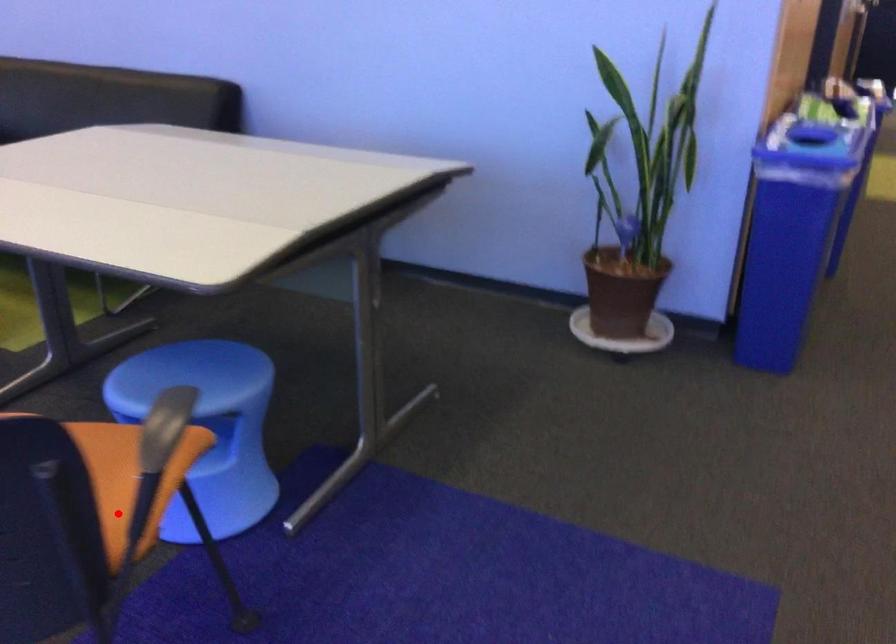
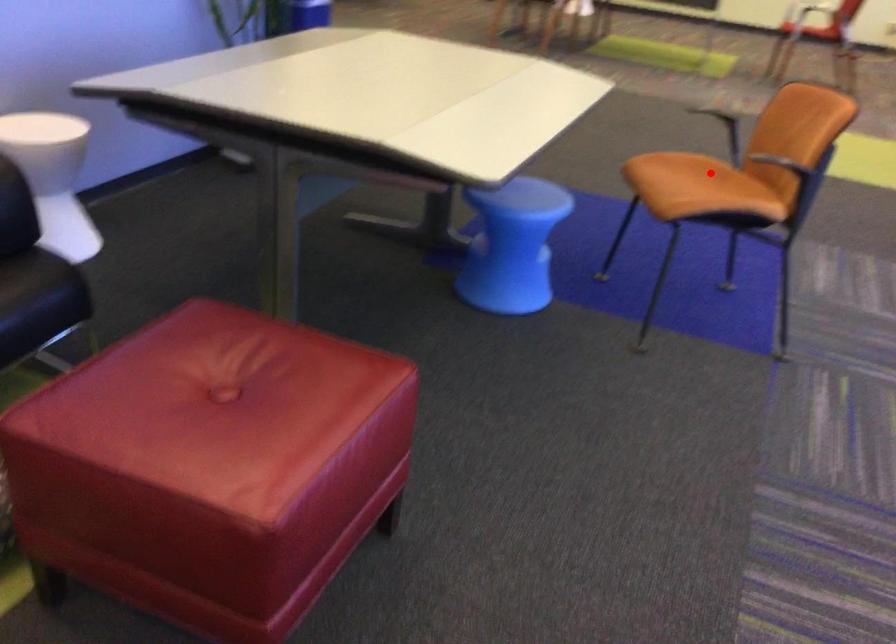
I am providing you with two images of the same scene from different viewpoints. A red point is marked on the first image and another point is marked on the second image. Do the highlighted points in image1 and image2 indicate the same real-world spot?

Yes